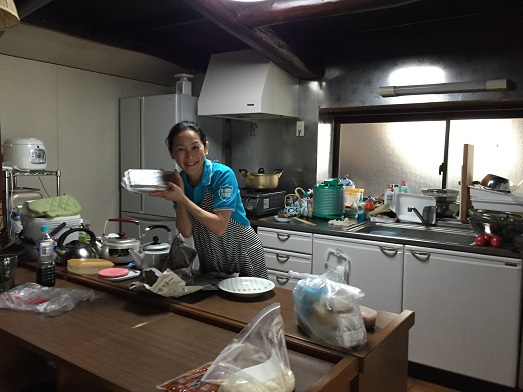
The image size is (523, 392). In order to click on kettle in this screenshot , I will do `click(160, 251)`, `click(116, 250)`.